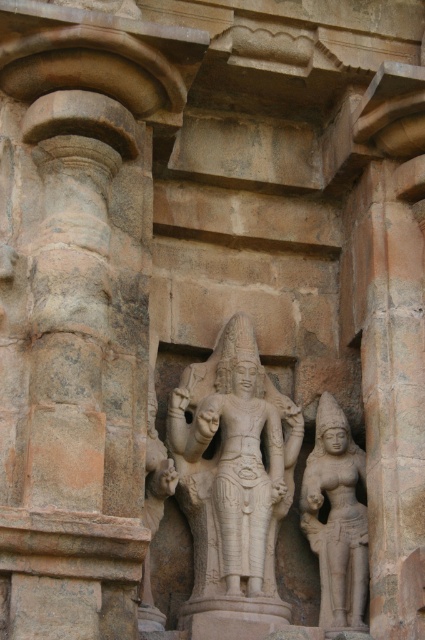
This screenshot has width=425, height=640. Describe the element at coordinates (234, 461) in the screenshot. I see `white stone statue at center` at that location.

Does white stone statue at center have a greater width compared to smooth stone statue at right?

Yes, white stone statue at center is wider than smooth stone statue at right.

This screenshot has width=425, height=640. Find the location of `white stone statue at center`. white stone statue at center is located at coordinates (234, 461).

Identify the location of white stone statue at center. (234, 461).